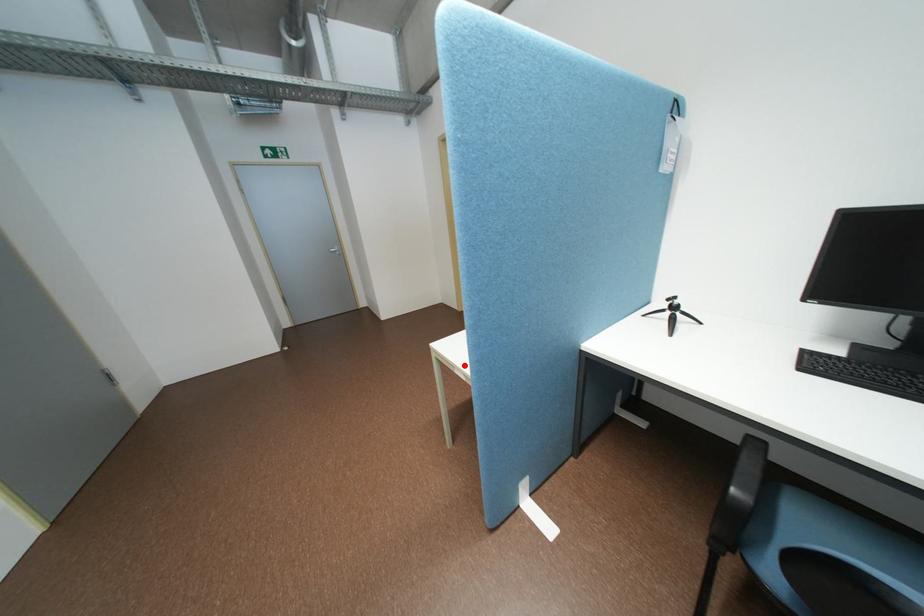
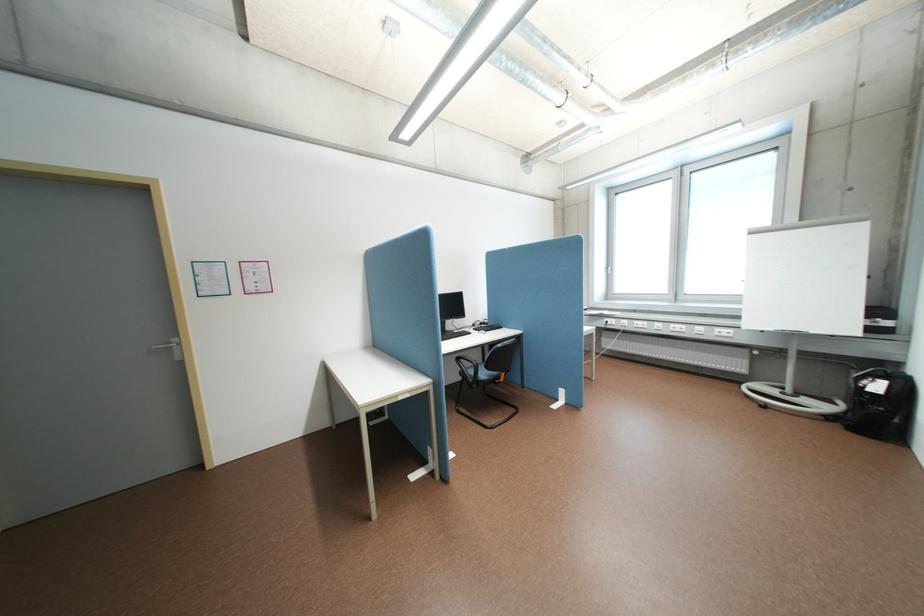
In the second image, find the point that corresponds to the highlighted location in the first image.

(407, 395)